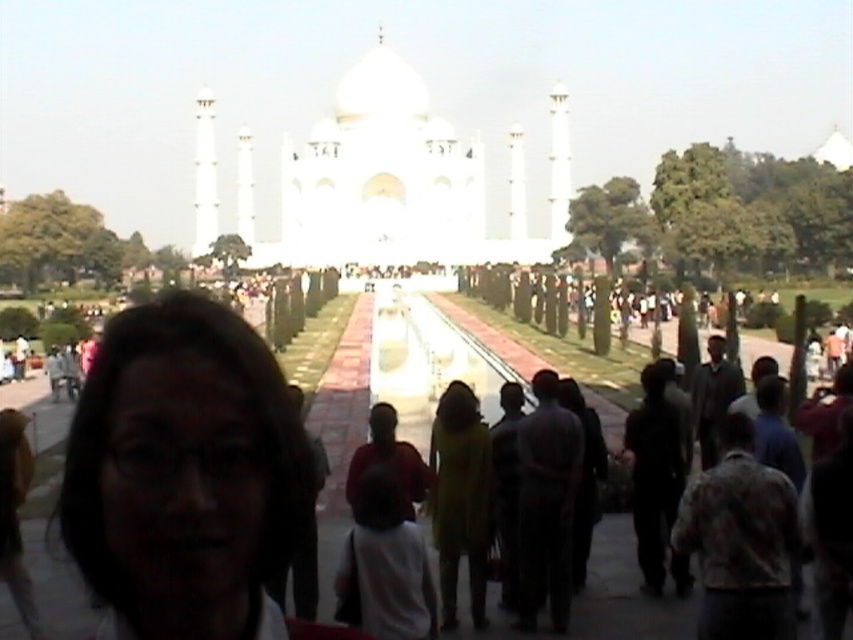
Is matte black hair at lower left taller than white marble palace at center?

In fact, matte black hair at lower left may be shorter than white marble palace at center.

Can you confirm if matte black hair at lower left is bigger than white marble palace at center?

Actually, matte black hair at lower left might be smaller than white marble palace at center.

Who is more forward, [195,340] or [384,154]?

Point [195,340]

This screenshot has height=640, width=853. Identify the location of matte black hair at lower left. (184, 472).